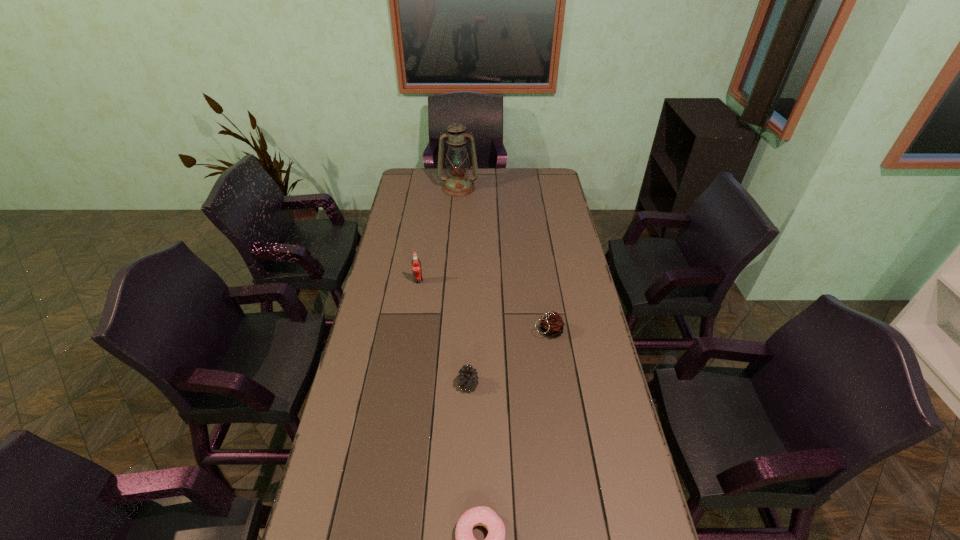
Identify the location of the third closest object to the tallest object. The height and width of the screenshot is (540, 960). (468, 377).

This screenshot has width=960, height=540. What are the coordinates of `object that is the third nearest to the second nearest object` in the screenshot? It's located at (416, 264).